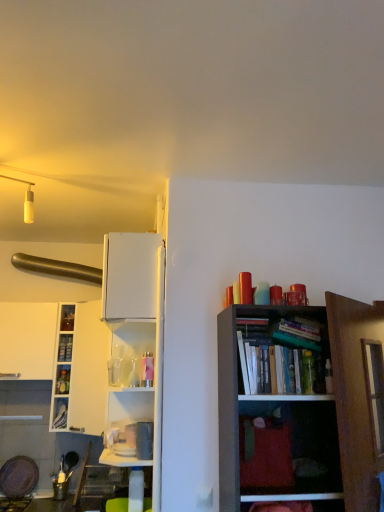
Identify the location of free space above hardcover book at upper right, which ranks as the first book in front-to-back order (from a real-world perspective). (278, 345).